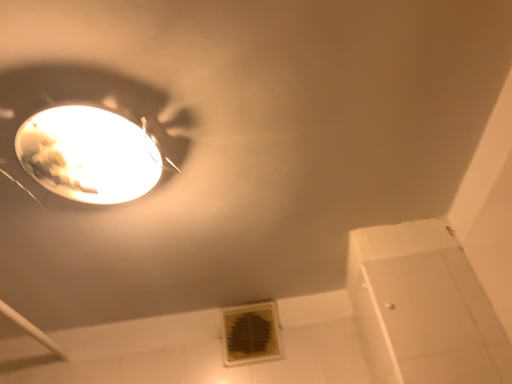
Measure the distance between matte white lamp at upper left and camera.

matte white lamp at upper left and camera are 26.63 inches apart.

I want to click on matte white lamp at upper left, so click(75, 108).

Describe the element at coordinates (75, 108) in the screenshot. This screenshot has height=384, width=512. I see `matte white lamp at upper left` at that location.

Where is `white plastic air conditioning at lower center`? Image resolution: width=512 pixels, height=384 pixels. white plastic air conditioning at lower center is located at coordinates (251, 333).

What do you see at coordinates (251, 333) in the screenshot? I see `white plastic air conditioning at lower center` at bounding box center [251, 333].

Image resolution: width=512 pixels, height=384 pixels. Identify the location of matte white lamp at upper left. (75, 108).

Is white plastic air conditioning at lower center to the left of matte white lamp at upper left from the viewer's perspective?

No.

Is the position of white plastic air conditioning at lower center less distant than that of matte white lamp at upper left?

That is False.

Between point (230, 312) and point (5, 154), which one is positioned in front?

The point (5, 154) is closer to the camera.

From the image's perspective, is white plastic air conditioning at lower center above matte white lamp at upper left?

No, from the image's perspective, white plastic air conditioning at lower center is not above matte white lamp at upper left.

From a real-world perspective, is white plastic air conditioning at lower center on matte white lamp at upper left?

No, from a real-world perspective, white plastic air conditioning at lower center is not on top of matte white lamp at upper left.

Does white plastic air conditioning at lower center have a lesser width compared to matte white lamp at upper left?

Yes, white plastic air conditioning at lower center is thinner than matte white lamp at upper left.

Who is taller, white plastic air conditioning at lower center or matte white lamp at upper left?

Standing taller between the two is white plastic air conditioning at lower center.

In terms of size, does white plastic air conditioning at lower center appear bigger or smaller than matte white lamp at upper left?

In the image, white plastic air conditioning at lower center appears to be smaller than matte white lamp at upper left.

Is white plastic air conditioning at lower center inside the boundaries of matte white lamp at upper left, or outside?

white plastic air conditioning at lower center is not inside matte white lamp at upper left, it's outside.

Is the surface of white plastic air conditioning at lower center in direct contact with matte white lamp at upper left?

white plastic air conditioning at lower center and matte white lamp at upper left are not in contact.

In the scene shown: Is white plastic air conditioning at lower center turned away from matte white lamp at upper left?

white plastic air conditioning at lower center does not have its back to matte white lamp at upper left.

Locate an element on the screen. lamp above the white plastic air conditioning at lower center (from the image's perspective) is located at coordinates (75, 108).

Based on their positions, is matte white lamp at upper left located to the left or right of white plastic air conditioning at lower center?

Based on their positions, matte white lamp at upper left is located to the left of white plastic air conditioning at lower center.

Between matte white lamp at upper left and white plastic air conditioning at lower center, which one is positioned behind?

white plastic air conditioning at lower center.

Considering the points (110, 88) and (275, 305), which point is behind, point (110, 88) or point (275, 305)?

The point (275, 305) is behind.

From the image's perspective, is matte white lamp at upper left under white plastic air conditioning at lower center?

No, from the image's perspective, matte white lamp at upper left is not below white plastic air conditioning at lower center.

From a real-world perspective, is matte white lamp at upper left above or below white plastic air conditioning at lower center?

In terms of real-world spatial position, matte white lamp at upper left is above white plastic air conditioning at lower center.

Does matte white lamp at upper left have a greater width compared to white plastic air conditioning at lower center?

Yes, matte white lamp at upper left is wider than white plastic air conditioning at lower center.

Considering the relative sizes of matte white lamp at upper left and white plastic air conditioning at lower center in the image provided, is matte white lamp at upper left taller than white plastic air conditioning at lower center?

No.

Considering the sizes of objects matte white lamp at upper left and white plastic air conditioning at lower center in the image provided, who is bigger, matte white lamp at upper left or white plastic air conditioning at lower center?

Bigger between the two is matte white lamp at upper left.

Based on the photo, is matte white lamp at upper left not within white plastic air conditioning at lower center?

Yes, matte white lamp at upper left is outside of white plastic air conditioning at lower center.

Is matte white lamp at upper left far from white plastic air conditioning at lower center?

Actually, matte white lamp at upper left and white plastic air conditioning at lower center are a little close together.

Is matte white lamp at upper left positioned with its back to white plastic air conditioning at lower center?

Correct, matte white lamp at upper left is looking away from white plastic air conditioning at lower center.

How many degrees apart are the facing directions of matte white lamp at upper left and white plastic air conditioning at lower center?

The angle between the facing direction of matte white lamp at upper left and the facing direction of white plastic air conditioning at lower center is 5.08 degrees.

Consider the image. How distant is matte white lamp at upper left from white plastic air conditioning at lower center?

matte white lamp at upper left is 30.81 inches from white plastic air conditioning at lower center.

In the image, there is a matte white lamp at upper left. Where is `air conditioning below it (from a real-world perspective)`? The image size is (512, 384). air conditioning below it (from a real-world perspective) is located at coordinates (251, 333).

What are the coordinates of `lamp positioned vertically above the white plastic air conditioning at lower center (from a real-world perspective)` in the screenshot? It's located at (75, 108).

Identify the location of lamp on the left of white plastic air conditioning at lower center. (75, 108).